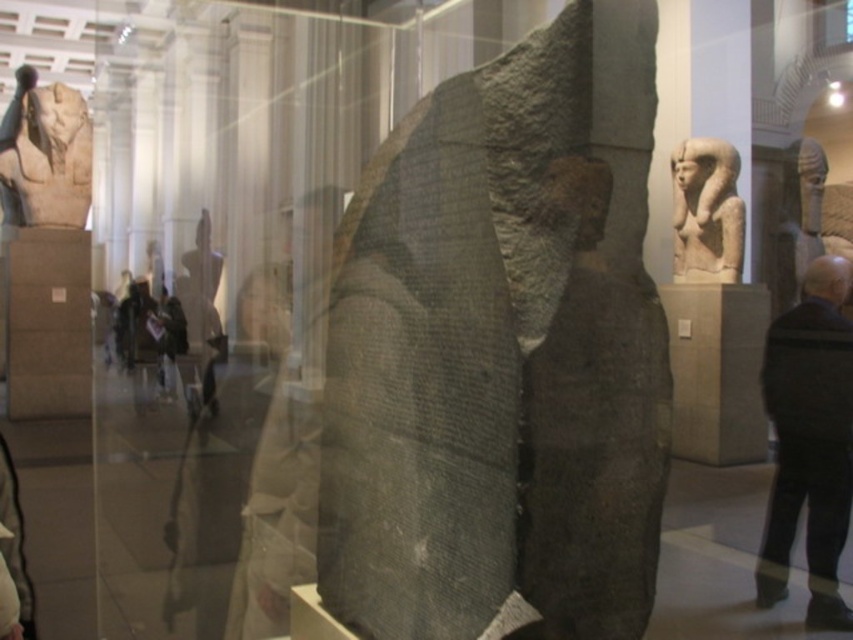
Question: Is black wool coat at right to the left of light beige stone statue at upper right from the viewer's perspective?

Choices:
 (A) yes
 (B) no

Answer: (A)

Question: Is light beige fabric at center further to the viewer compared to light beige stone statue at upper right?

Choices:
 (A) yes
 (B) no

Answer: (B)

Question: Considering the real-world distances, which object is closest to the gray stone stele at center?

Choices:
 (A) light beige fabric at center
 (B) matte stone statue at upper left
 (C) light beige stone statue at upper right

Answer: (A)

Question: Estimate the real-world distances between objects in this image. Which object is farther from the matte stone statue at upper left?

Choices:
 (A) black wool coat at right
 (B) light beige fabric at center

Answer: (A)

Question: Is gray stone stele at center above light beige stone statue at upper right?

Choices:
 (A) yes
 (B) no

Answer: (B)

Question: Among these objects, which one is nearest to the camera?

Choices:
 (A) light beige fabric at center
 (B) gray stone stele at center
 (C) matte stone statue at upper left

Answer: (B)